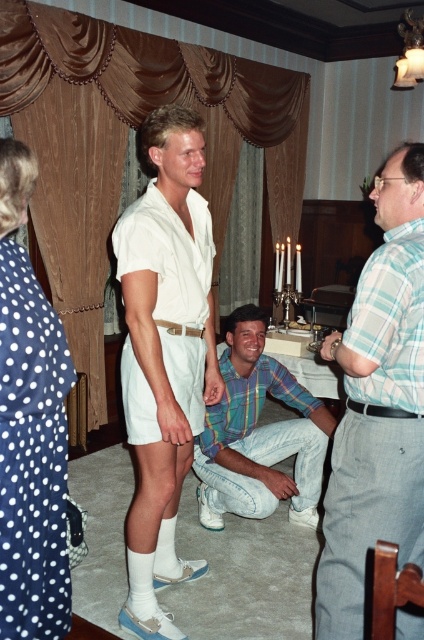
Question: Among these points, which one is nearest to the camera?

Choices:
 (A) (248, 385)
 (B) (423, 296)
 (C) (13, 321)
 (D) (117, 269)

Answer: (C)

Question: Does white matte shorts at center have a larger size compared to plaid cotton shirt at center?

Choices:
 (A) yes
 (B) no

Answer: (A)

Question: Which point is closer to the camera taking this photo?

Choices:
 (A) (11, 484)
 (B) (170, 186)

Answer: (A)

Question: Which object is the closest to the plaid shirt at center?

Choices:
 (A) white matte shorts at center
 (B) white polka dot dress at left

Answer: (A)

Question: Is plaid shirt at center wider than white polka dot dress at left?

Choices:
 (A) yes
 (B) no

Answer: (A)

Question: Does plaid shirt at center appear on the left side of white polka dot dress at left?

Choices:
 (A) yes
 (B) no

Answer: (B)